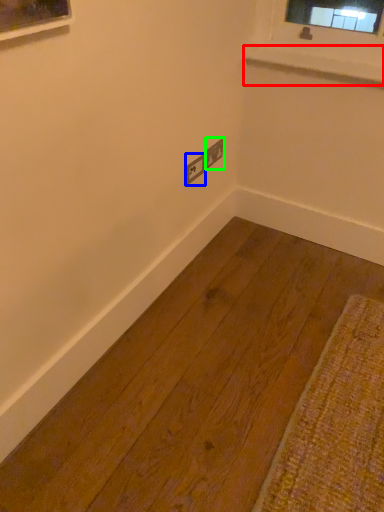
Question: Which object is the closest to the window sill (highlighted by a red box)? Choose among these: electric outlet (highlighted by a blue box) or electric outlet (highlighted by a green box).

Choices:
 (A) electric outlet
 (B) electric outlet

Answer: (B)